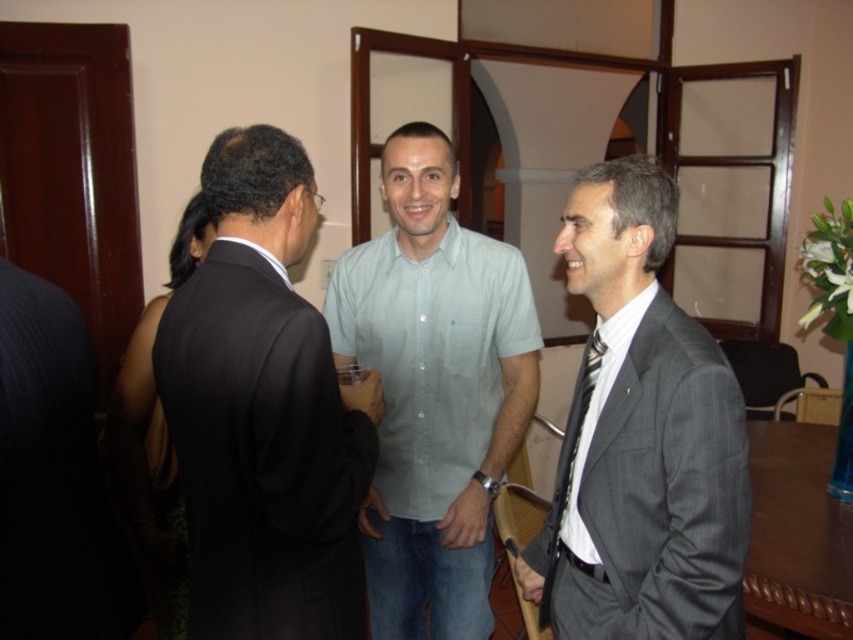
You are standing at the entrance of the room and see both the dark suit at center and the light blue cotton shirt at center. Which one appears closer to you?

The dark suit at center appears closer to you because it is positioned closer to the viewer than the light blue cotton shirt at center.

You are a photographer at the event and need to capture a closeup of the gray pinstripe suit at right and the black striped tie at right. What is the minimum distance you should set your camera lens to focus on both objects clearly?

The gray pinstripe suit at right is 5.55 inches from the black striped tie at right. To ensure both are in focus, the camera lens should be set to a minimum distance that can accommodate this separation between the two objects.

You are standing at the origin point of the coordinate system in the image. You want to walk to the dark suit at center. What direction should you move in to reach it?

You should move towards the coordinates point (264, 412) to reach the dark suit at center.